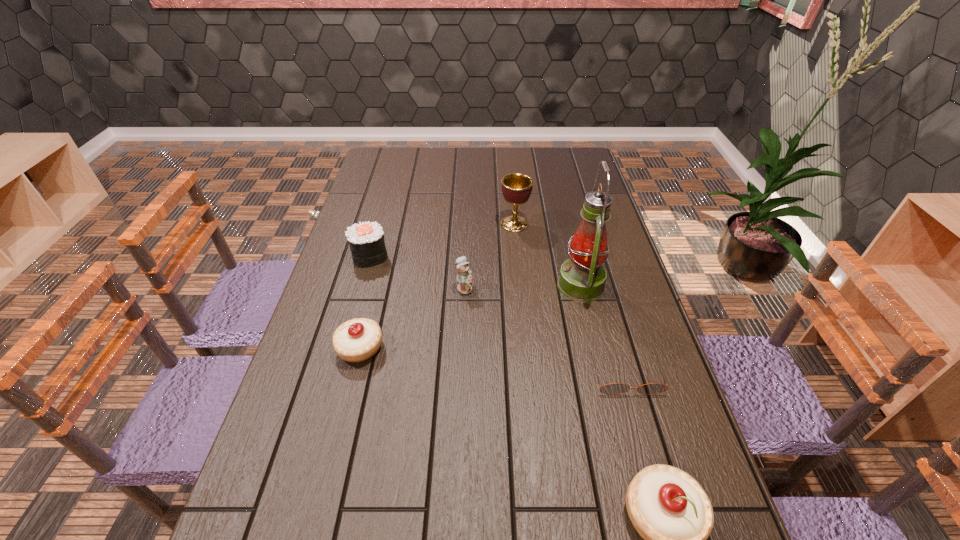
You are a GUI agent. You are given a task and a screenshot of the screen. Output one action in this format:
    pyautogui.click(x=<x>, y=<y>)
    Task: Click on the object that is the sixth closest to the fifth object from right to left
    The image size is (960, 540).
    Given the screenshot: What is the action you would take?
    pyautogui.click(x=669, y=509)